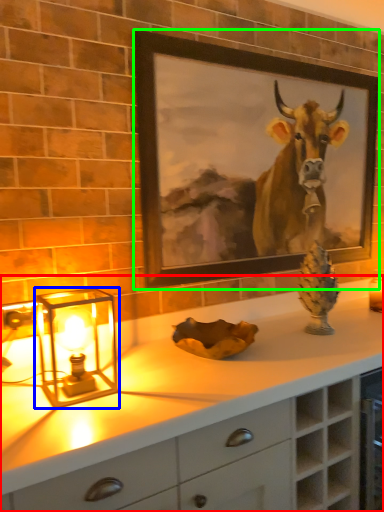
Question: Which is farther away from countertop (highlighted by a red box)? table lamp (highlighted by a blue box) or picture frame (highlighted by a green box)?

Choices:
 (A) table lamp
 (B) picture frame

Answer: (B)